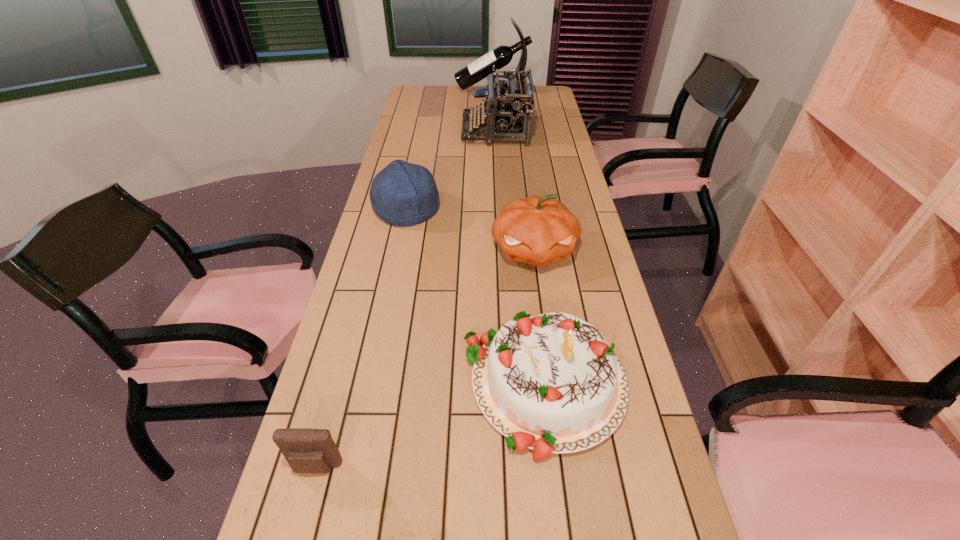
Locate an element on the screen. free space between the pumpkin and the shortest object is located at coordinates (425, 359).

The image size is (960, 540). What are the coordinates of `vacant area between the typewriter and the pumpkin` in the screenshot? It's located at (515, 190).

Locate an element on the screen. This screenshot has width=960, height=540. object that is the third closest to the pumpkin is located at coordinates (510, 114).

You are a GUI agent. You are given a task and a screenshot of the screen. Output one action in this format:
    pyautogui.click(x=<x>, y=<y>)
    Task: Click on the fourth closest object relative to the pouch
    
    Given the screenshot: What is the action you would take?
    pyautogui.click(x=510, y=114)

Find the location of a particular element. free region that satisfies the following two spatial constraints: 1. on the stand of the wine bottle; 2. with an open flap on the pouch is located at coordinates (510, 468).

This screenshot has width=960, height=540. Find the location of `free space that satisfies the following two spatial constraints: 1. on the typing side of the typewriter; 2. on the front side of the skullcap`. free space that satisfies the following two spatial constraints: 1. on the typing side of the typewriter; 2. on the front side of the skullcap is located at coordinates (500, 210).

Where is `vacant area that satisfies the following two spatial constraints: 1. on the stand of the tallest object; 2. with an open flap on the shortest object`? vacant area that satisfies the following two spatial constraints: 1. on the stand of the tallest object; 2. with an open flap on the shortest object is located at coordinates (510, 468).

Where is `vacant region that satisfies the following two spatial constraints: 1. on the typing side of the second farthest object; 2. with an open flap on the pouch`? This screenshot has width=960, height=540. vacant region that satisfies the following two spatial constraints: 1. on the typing side of the second farthest object; 2. with an open flap on the pouch is located at coordinates (516, 468).

Where is `vacant area in the image that satisfies the following two spatial constraints: 1. on the typing side of the fifth nearest object; 2. on the front side of the skullcap`? vacant area in the image that satisfies the following two spatial constraints: 1. on the typing side of the fifth nearest object; 2. on the front side of the skullcap is located at coordinates (500, 210).

Find the location of a particular element. The image size is (960, 540). vacant region that satisfies the following two spatial constraints: 1. on the stand of the tallest object; 2. on the right side of the cake is located at coordinates (506, 384).